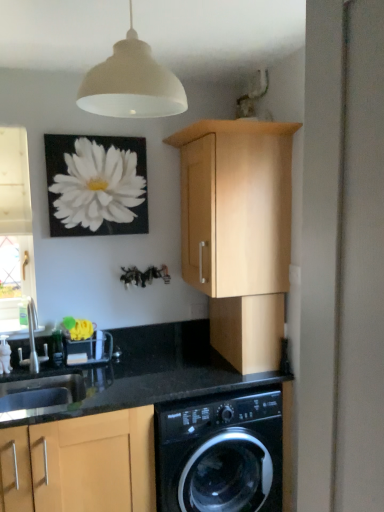
Find the location of `unoccupied region to the right of silver metallic faucet at lower left`. unoccupied region to the right of silver metallic faucet at lower left is located at coordinates (83, 368).